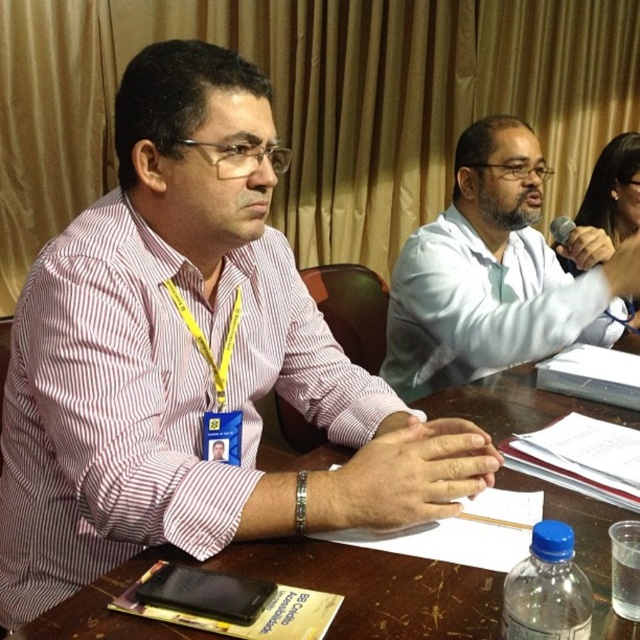
Question: Which of the following is the farthest from the observer?

Choices:
 (A) pink striped shirt at left
 (B) brown wooden table at center
 (C) blue plastic bottle at bottom right

Answer: (A)

Question: Is pink striped shirt at left below brown wooden table at center?

Choices:
 (A) yes
 (B) no

Answer: (B)

Question: Is white matte shirt at center above metallic silver microphone at upper right?

Choices:
 (A) yes
 (B) no

Answer: (B)

Question: Is pink striped shirt at left to the left of brown wooden table at center from the viewer's perspective?

Choices:
 (A) no
 (B) yes

Answer: (B)

Question: Which of the following is the farthest from the observer?

Choices:
 (A) (556, 218)
 (B) (522, 376)
 (C) (516, 330)

Answer: (A)

Question: Which object is the farthest from the metallic silver microphone at upper right?

Choices:
 (A) brown wooden table at center
 (B) pink striped shirt at left
 (C) white matte shirt at center
 (D) blue plastic bottle at bottom right

Answer: (D)